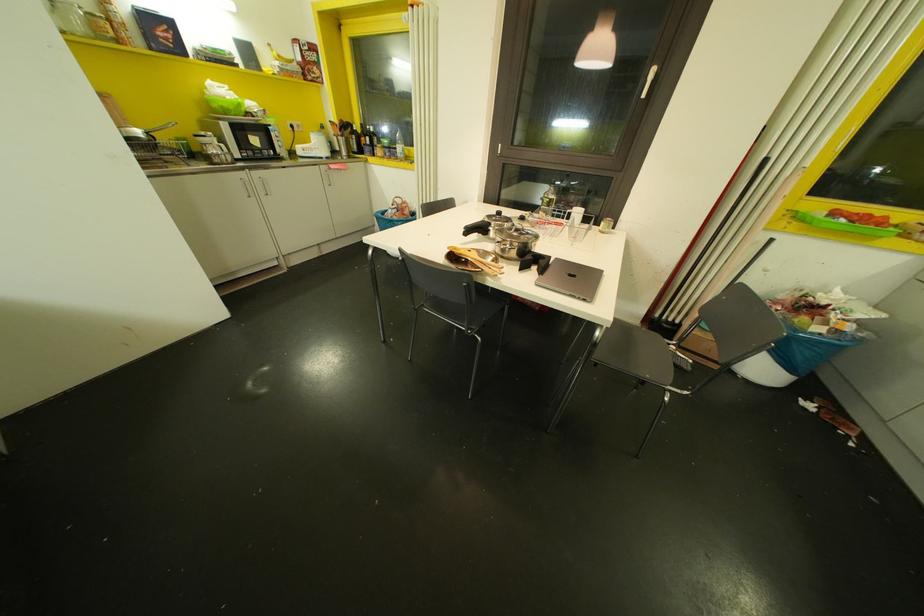
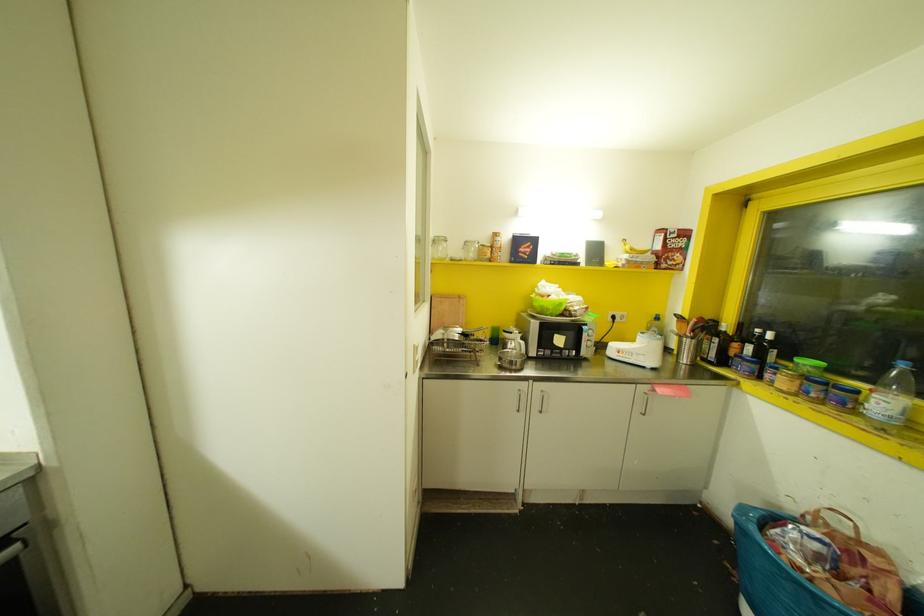
The point at (367, 138) is marked in the first image. Where is the corresponding point in the second image?

(748, 347)